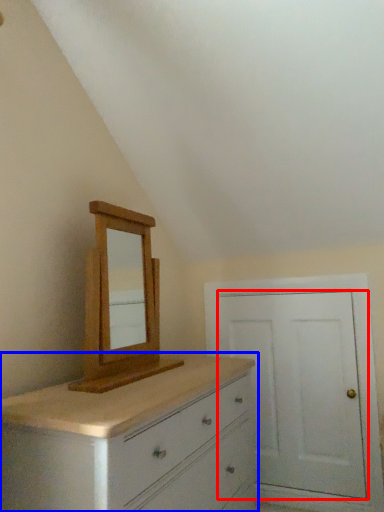
Question: Which point is further to the camera, door (highlighted by a red box) or chest of drawers (highlighted by a blue box)?

Choices:
 (A) door
 (B) chest of drawers

Answer: (A)